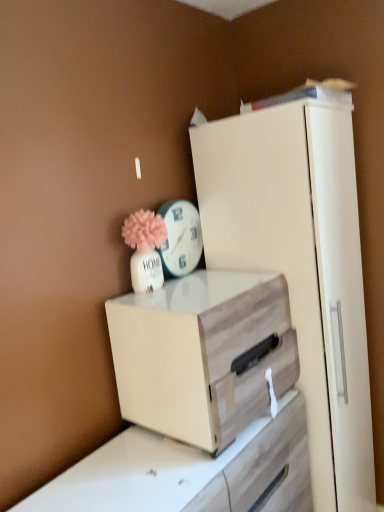
Question: Considering the relative positions of wooden chest of drawers at center and white glossy clock at upper center in the image provided, is wooden chest of drawers at center to the left or to the right of white glossy clock at upper center?

Choices:
 (A) right
 (B) left

Answer: (A)

Question: From a real-world perspective, relative to white glossy clock at upper center, is wooden chest of drawers at center vertically above or below?

Choices:
 (A) below
 (B) above

Answer: (A)

Question: Is point (231, 370) positioned closer to the camera than point (185, 202)?

Choices:
 (A) closer
 (B) farther

Answer: (A)

Question: Looking at their shapes, would you say white glossy clock at upper center is wider or thinner than wooden chest of drawers at center?

Choices:
 (A) thin
 (B) wide

Answer: (A)

Question: Visually, is white glossy clock at upper center positioned to the left or to the right of wooden chest of drawers at center?

Choices:
 (A) left
 (B) right

Answer: (A)

Question: From a real-world perspective, is white glossy clock at upper center physically located above or below wooden chest of drawers at center?

Choices:
 (A) above
 (B) below

Answer: (A)

Question: In terms of size, does white glossy clock at upper center appear bigger or smaller than wooden chest of drawers at center?

Choices:
 (A) big
 (B) small

Answer: (B)